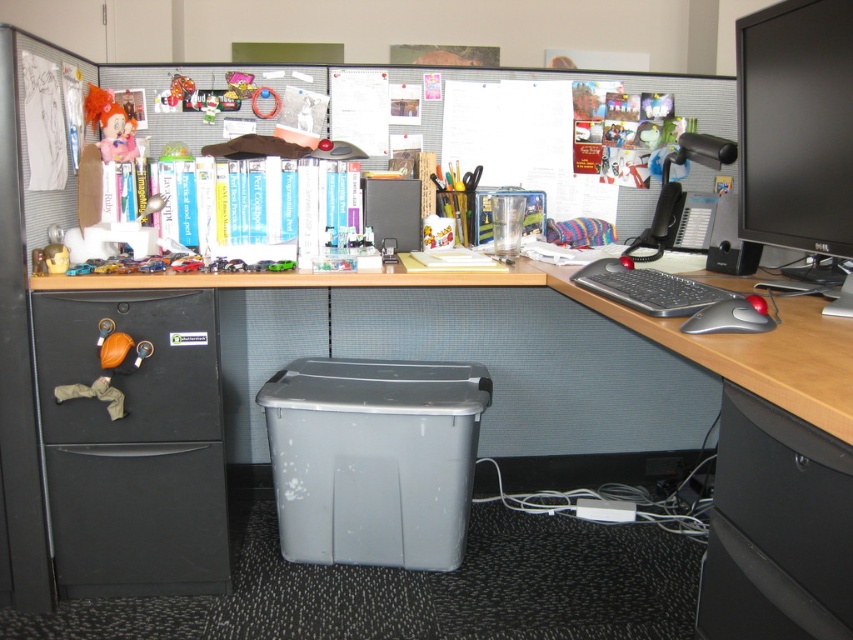
You are standing in front of the office desk and need to determine the relative positions of two points marked on the desk surface. The first point is at coordinates point (782, 412) and the second is at point (660, 284). Which point is closer to you?

Point (782, 412) is closer to the viewer than point (660, 284).

You are an office worker trying to locate your black glossy monitor at upper right. Based on the coordinates provided in the Objects Description, can you determine its position relative to the desk?

The black glossy monitor at upper right is located at point coordinates of 0.197 on the x axis and 0.934 on the y axis, which places it at the upper right corner of the desk surface.

What object is located at the coordinates point (x=132, y=445) in the office cubicle workspace?

The object at point (x=132, y=445) is the black matte file cabinet at left.